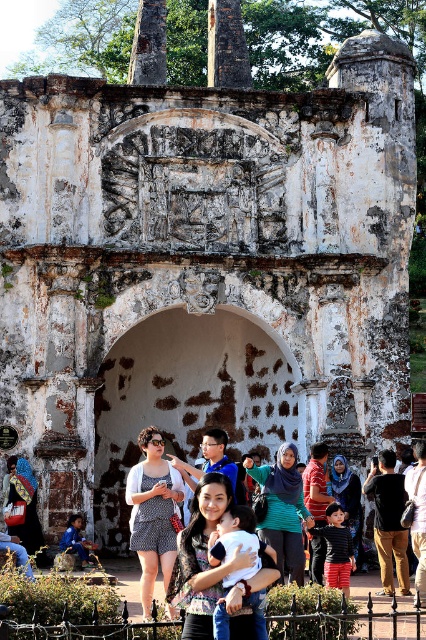
You are standing at the base of the weathered stone archway and want to take a photo of the point at coordinate point (397, 528). The camera you are using has a maximum focus range of 200 feet. Will the camera be able to focus on the point?

The distance of point (397, 528) from the camera is 199.59 feet, which is within the camera maximum focus range of 200 feet. Therefore, the camera can focus on the point.

You are a photographer standing in front of the historical stone archway. You notice two tourists wearing a black cotton shirt at center and a striped shirt at center. If you want to take a photo that includes both shirts, which one should you move to ensure both are visible?

The black cotton shirt at center is in front of the striped shirt at center. To ensure both are visible in the photo, you should ask the person wearing the black cotton shirt at center to move slightly backward or to the side so that the striped shirt at center is not obscured.